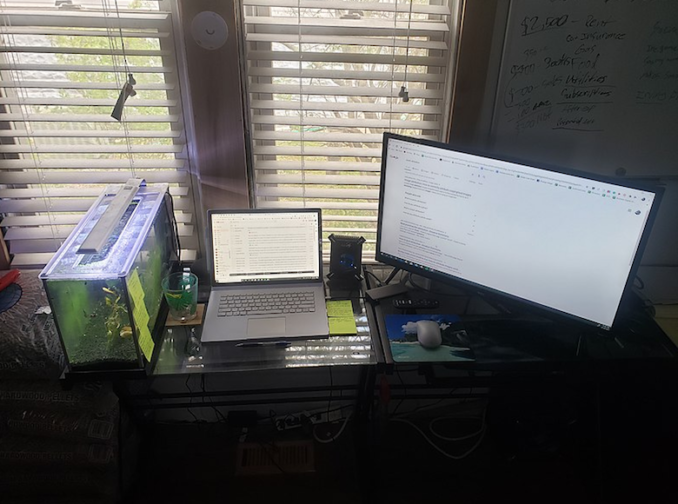
Where is `whiteboard`? This screenshot has height=504, width=678. whiteboard is located at coordinates (607, 116).